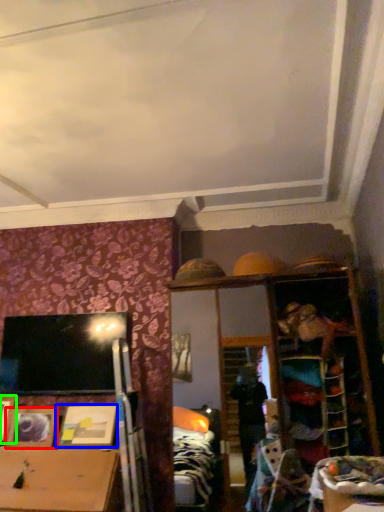
Question: Which is nearer to the picture frame (highlighted by a red box)? picture frame (highlighted by a blue box) or picture frame (highlighted by a green box).

Choices:
 (A) picture frame
 (B) picture frame

Answer: (B)